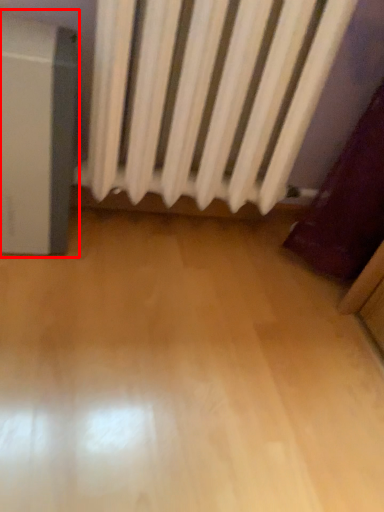
Question: From the image's perspective, where is appliance (annotated by the red box) located relative to curtain?

Choices:
 (A) below
 (B) above

Answer: (A)